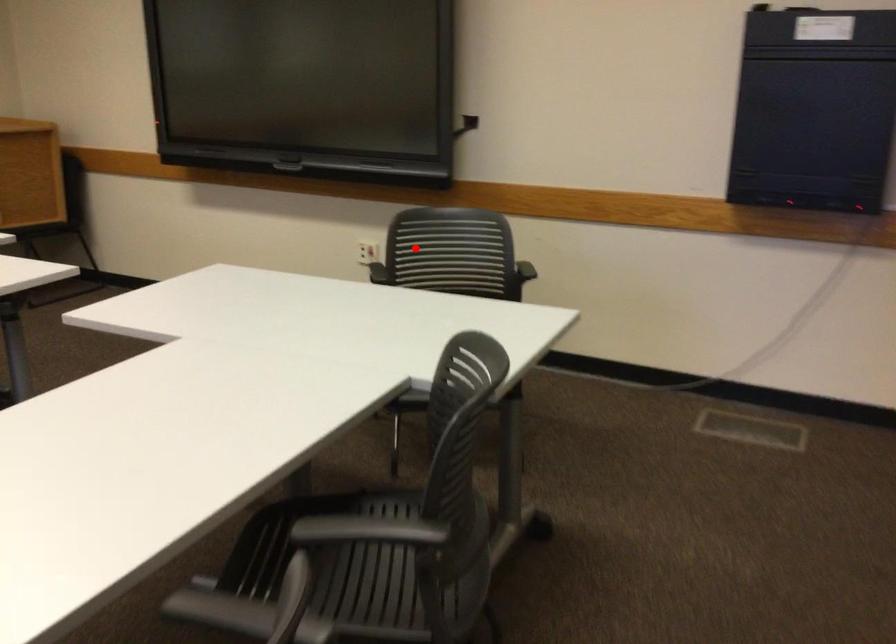
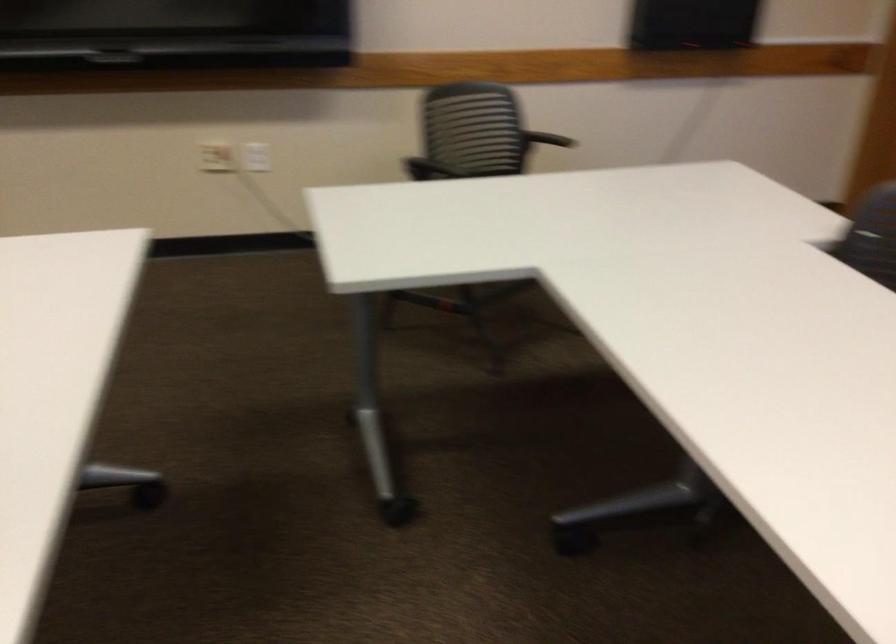
The point at the highlighted location is marked in the first image. Where is the corresponding point in the second image?

(216, 156)